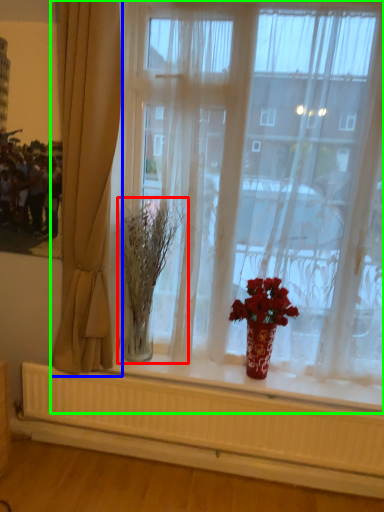
Question: Based on their relative distances, which object is nearer to plant (highlighted by a red box)? Choose from curtain (highlighted by a blue box) and window (highlighted by a green box).

Choices:
 (A) curtain
 (B) window

Answer: (A)